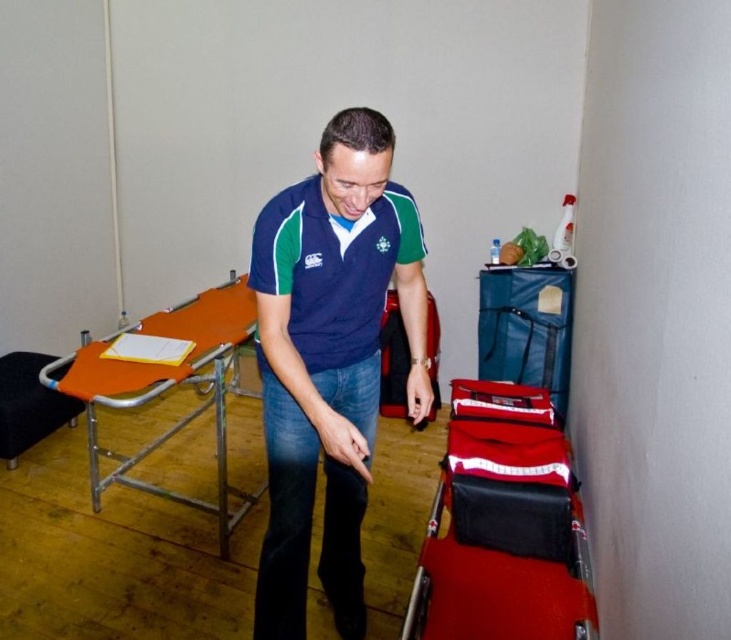
Question: Considering the real-world distances, which object is closest to the teal fabric suitcase at right?

Choices:
 (A) red leather suitcase at lower right
 (B) orange matte stretcher at left
 (C) red plastic cart at lower right
 (D) navy blue jersey at center

Answer: (A)

Question: Which point appears farthest from the camera in this image?

Choices:
 (A) (29, 416)
 (B) (329, 305)

Answer: (A)

Question: Can you confirm if orange matte stretcher at left is bigger than red plastic cart at lower right?

Choices:
 (A) yes
 (B) no

Answer: (A)

Question: Is orange matte stretcher at left smaller than teal fabric suitcase at right?

Choices:
 (A) no
 (B) yes

Answer: (A)

Question: Can you confirm if blue cotton shirt at center is wider than teal fabric suitcase at right?

Choices:
 (A) no
 (B) yes

Answer: (B)

Question: Which point appears closest to the camera in this image?

Choices:
 (A) pyautogui.click(x=298, y=314)
 (B) pyautogui.click(x=591, y=612)
 (C) pyautogui.click(x=7, y=442)
 (D) pyautogui.click(x=542, y=308)

Answer: (B)